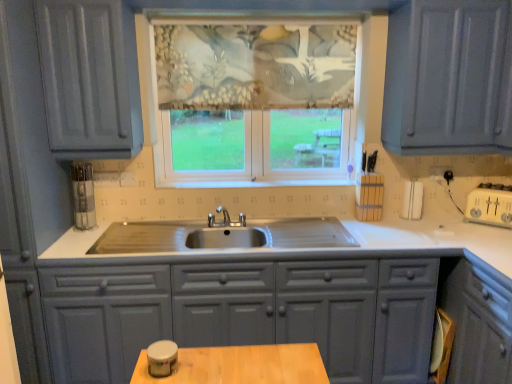
This screenshot has width=512, height=384. Describe the element at coordinates (245, 314) in the screenshot. I see `matte gray cabinets at center` at that location.

I want to click on textured fabric window at center, so click(252, 95).

Measure the distance between textured fabric window at center and camera.

They are 7.49 feet apart.

Locate an element on the screen. This screenshot has height=384, width=512. matte gray cabinets at center is located at coordinates (245, 314).

Which object is thinner, textured floral fabric at center or textured fabric window at center?

Thinner between the two is textured floral fabric at center.

What's the angular difference between textured floral fabric at center and textured fabric window at center's facing directions?

They differ by 0.000484 degrees in their facing directions.

Is textured floral fabric at center bigger or smaller than textured fabric window at center?

Clearly, textured floral fabric at center is smaller in size than textured fabric window at center.

Is textured floral fabric at center further to camera compared to matte gray cabinets at center?

→ That is True.

Based on their sizes in the image, would you say textured floral fabric at center is bigger or smaller than matte gray cabinets at center?

textured floral fabric at center is smaller than matte gray cabinets at center.

Is textured floral fabric at center taller or shorter than matte gray cabinets at center?

Considering their sizes, textured floral fabric at center has less height than matte gray cabinets at center.

Where is `curtain lying behind the matte gray cabinets at center`? curtain lying behind the matte gray cabinets at center is located at coordinates (255, 66).

Does point (95, 344) lie behind point (239, 66)?

No.

Consider the image. Is matte gray cabinets at center shorter than textured fabric window at center?

Yes.

Can you confirm if matte gray cabinets at center is thinner than textured fabric window at center?

Incorrect, the width of matte gray cabinets at center is not less than that of textured fabric window at center.

Is matte gray cabinets at center at the right side of textured fabric window at center?

No, matte gray cabinets at center is not to the right of textured fabric window at center.

Is textured fabric window at center facing towards textured floral fabric at center?

Yes.

Are textured fabric window at center and textured floral fabric at center making contact?

Yes, textured fabric window at center is right next to textured floral fabric at center and making contact.

Is textured fabric window at center not within textured floral fabric at center?

Actually, textured fabric window at center is within textured floral fabric at center.

How many degrees apart are the facing directions of textured fabric window at center and textured floral fabric at center?

They differ by 0.000484 degrees in their facing directions.

Which object is wider, textured fabric window at center or matte gray cabinets at center?

Wider between the two is matte gray cabinets at center.

Are textured fabric window at center and matte gray cabinets at center far apart?

No.

Considering the positions of objects textured fabric window at center and matte gray cabinets at center in the image provided, who is more to the left, textured fabric window at center or matte gray cabinets at center?

matte gray cabinets at center is more to the left.

Is matte gray cabinets at center positioned with its back to textured floral fabric at center?

matte gray cabinets at center does not have its back to textured floral fabric at center.

Is matte gray cabinets at center shorter than textured floral fabric at center?

No, matte gray cabinets at center is not shorter than textured floral fabric at center.

Identify the location of cabinetry that is in front of the textured floral fabric at center. coord(245,314).

I want to click on curtain located above the textured fabric window at center (from a real-world perspective), so click(x=255, y=66).

In order to click on cabinetry below the textured floral fabric at center (from the image's perspective) in this screenshot , I will do `click(245, 314)`.

Considering their positions, is textured fabric window at center positioned closer to textured floral fabric at center than matte gray cabinets at center?

The object closer to textured floral fabric at center is textured fabric window at center.

Based on their spatial positions, is textured floral fabric at center or textured fabric window at center closer to matte gray cabinets at center?

Based on the image, textured fabric window at center appears to be nearer to matte gray cabinets at center.

Considering their positions, is textured fabric window at center positioned closer to matte gray cabinets at center than textured floral fabric at center?

textured fabric window at center.

Looking at the image, which one is located further to textured fabric window at center, textured floral fabric at center or matte gray cabinets at center?

matte gray cabinets at center lies further to textured fabric window at center than the other object.

Based on their spatial positions, is matte gray cabinets at center or textured floral fabric at center further from textured fabric window at center?

matte gray cabinets at center is further to textured fabric window at center.

When comparing their distances from textured floral fabric at center, does matte gray cabinets at center or textured fabric window at center seem closer?

Among the two, textured fabric window at center is located nearer to textured floral fabric at center.

Locate an element on the screen. This screenshot has height=384, width=512. window between textured floral fabric at center and matte gray cabinets at center from top to bottom is located at coordinates (252, 95).